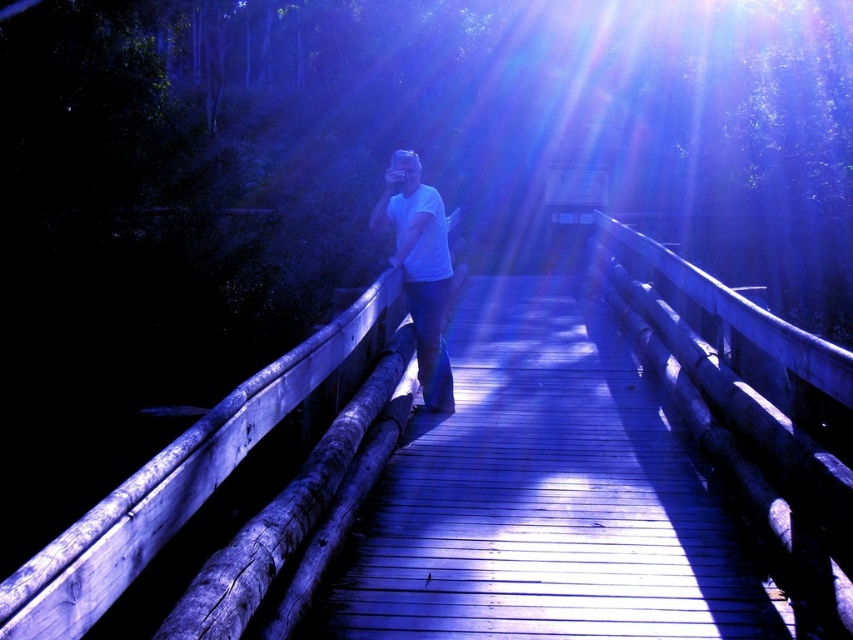
Question: Is wooden bridge at center positioned behind white matte shirt at center?

Choices:
 (A) yes
 (B) no

Answer: (B)

Question: Among these points, which one is farthest from the camera?

Choices:
 (A) (416, 156)
 (B) (666, 596)

Answer: (A)

Question: Can you confirm if wooden bridge at center is bigger than white matte shirt at center?

Choices:
 (A) no
 (B) yes

Answer: (A)

Question: Among these objects, which one is farthest from the camera?

Choices:
 (A) wooden bridge at center
 (B) white matte shirt at center

Answer: (B)

Question: Among these objects, which one is farthest from the camera?

Choices:
 (A) wooden bridge at center
 (B) white matte shirt at center

Answer: (B)

Question: Is wooden bridge at center thinner than white matte shirt at center?

Choices:
 (A) yes
 (B) no

Answer: (B)